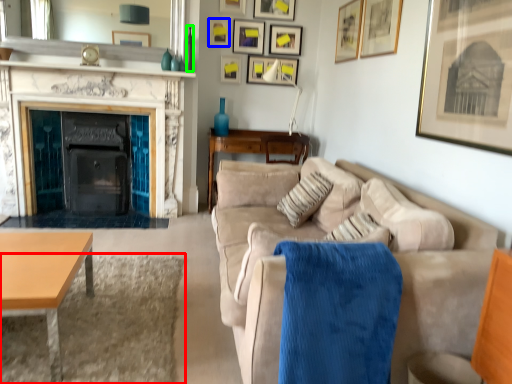
Question: Estimate the real-world distances between objects in this image. Which object is closer to plain (highlighted by a red box), picture frame (highlighted by a blue box) or vase (highlighted by a green box)?

Choices:
 (A) picture frame
 (B) vase

Answer: (B)